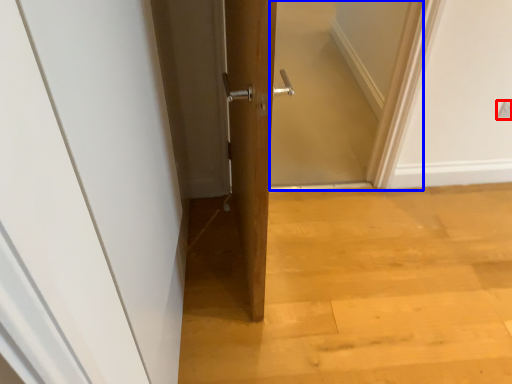
Question: Which point is further to the camera, electric outlet (highlighted by a red box) or screen door (highlighted by a blue box)?

Choices:
 (A) electric outlet
 (B) screen door

Answer: (A)